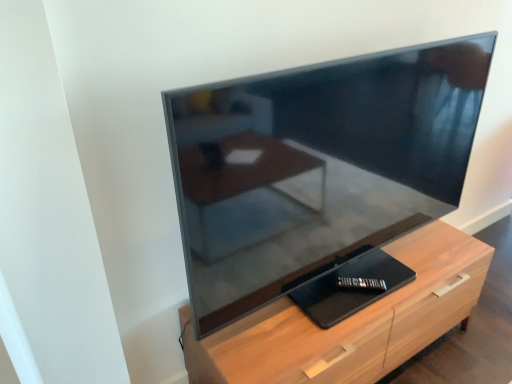
You are a GUI agent. You are given a task and a screenshot of the screen. Output one action in this format:
    pyautogui.click(x=<x>, y=<y>)
    Task: Click on the vacant space underneath matte black tv at center (from a real-world perspective)
    This screenshot has height=384, width=512.
    Given the screenshot: What is the action you would take?
    pyautogui.click(x=324, y=294)